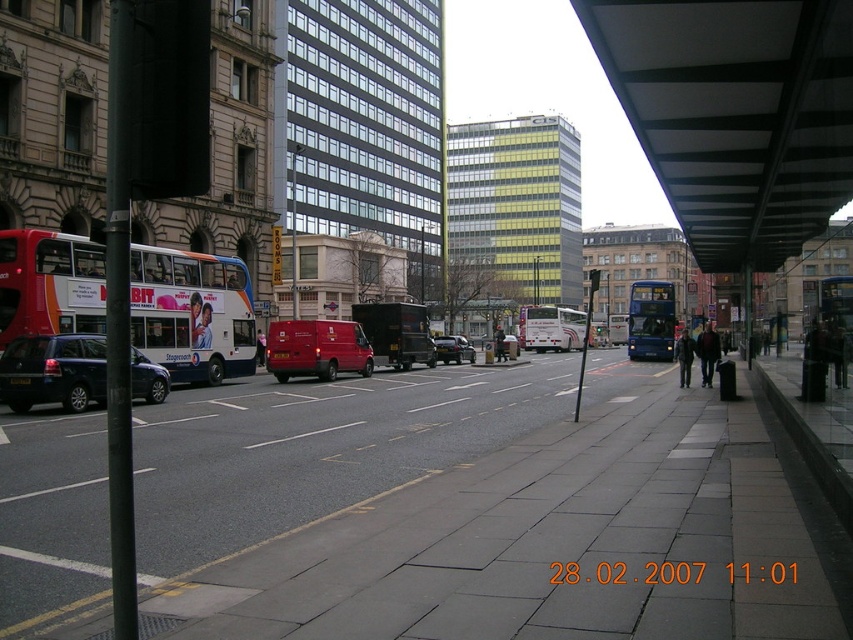
Is metallic red van at center above white matte bus at center?

No, metallic red van at center is not above white matte bus at center.

Which is more to the right, metallic red van at center or white matte bus at center?

white matte bus at center is more to the right.

Which is in front, point (292, 348) or point (543, 348)?

Point (292, 348) is more forward.

You are a GUI agent. You are given a task and a screenshot of the screen. Output one action in this format:
    pyautogui.click(x=<x>, y=<y>)
    Task: Click on the metallic red van at center
    This screenshot has width=853, height=640.
    Given the screenshot: What is the action you would take?
    pyautogui.click(x=316, y=348)

Who is more forward, (68, 310) or (33, 365)?

Point (33, 365) is more forward.

Does red matte double-decker bus at left have a lesser width compared to matte black suv at left?

No, red matte double-decker bus at left is not thinner than matte black suv at left.

Locate an element on the screen. Image resolution: width=853 pixels, height=640 pixels. red matte double-decker bus at left is located at coordinates (192, 314).

Find the location of a particular element. The width and height of the screenshot is (853, 640). red matte double-decker bus at left is located at coordinates (192, 314).

Does point (90, 572) lie in front of point (473, 349)?

Yes, point (90, 572) is closer to viewer.

Which is more to the left, gray concrete pavement at center or metallic silver car at center?

From the viewer's perspective, gray concrete pavement at center appears more on the left side.

The width and height of the screenshot is (853, 640). Describe the element at coordinates (474, 509) in the screenshot. I see `gray concrete pavement at center` at that location.

Identify the location of gray concrete pavement at center. The height and width of the screenshot is (640, 853). (474, 509).